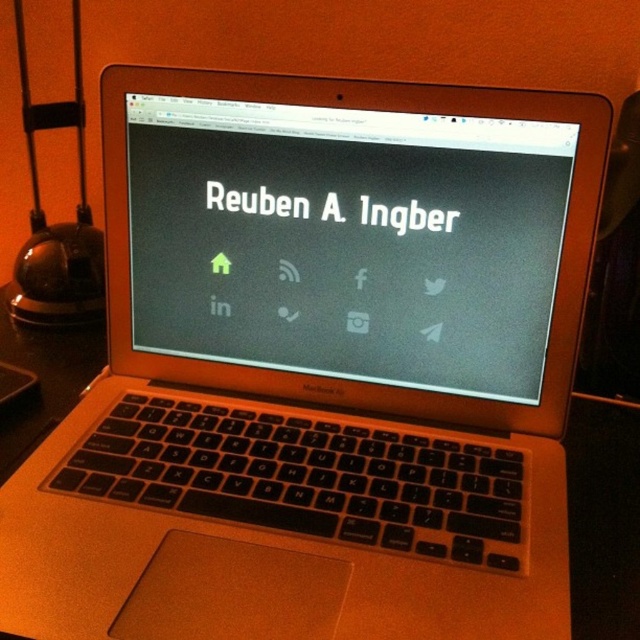
Question: Among these objects, which one is nearest to the camera?

Choices:
 (A) metallic glass table lamp at left
 (B) black matte screen at center

Answer: (B)

Question: Which point is closer to the camera?

Choices:
 (A) (26, 275)
 (B) (529, 365)

Answer: (B)

Question: Does black matte screen at center have a lesser width compared to metallic glass table lamp at left?

Choices:
 (A) yes
 (B) no

Answer: (B)

Question: Can you confirm if black matte screen at center is bigger than metallic glass table lamp at left?

Choices:
 (A) yes
 (B) no

Answer: (B)

Question: Can you confirm if black matte screen at center is thinner than metallic glass table lamp at left?

Choices:
 (A) yes
 (B) no

Answer: (B)